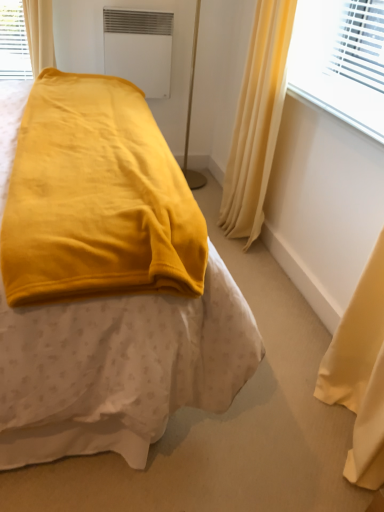
Question: Would you say white matte air conditioning unit at upper center contains smooth plastic window sill at upper right?

Choices:
 (A) no
 (B) yes

Answer: (A)

Question: Does white matte air conditioning unit at upper center come in front of smooth plastic window sill at upper right?

Choices:
 (A) no
 (B) yes

Answer: (A)

Question: Does white matte air conditioning unit at upper center appear on the left side of smooth plastic window sill at upper right?

Choices:
 (A) no
 (B) yes

Answer: (B)

Question: Are white matte air conditioning unit at upper center and smooth plastic window sill at upper right making contact?

Choices:
 (A) yes
 (B) no

Answer: (B)

Question: Considering the relative sizes of white matte air conditioning unit at upper center and smooth plastic window sill at upper right in the image provided, is white matte air conditioning unit at upper center bigger than smooth plastic window sill at upper right?

Choices:
 (A) yes
 (B) no

Answer: (A)

Question: Is white matte air conditioning unit at upper center thinner than smooth plastic window sill at upper right?

Choices:
 (A) no
 (B) yes

Answer: (B)

Question: Can silky yellow curtain at upper right be found inside velvet yellow blanket at center?

Choices:
 (A) no
 (B) yes

Answer: (A)

Question: Is velvet yellow blanket at center not near silky yellow curtain at upper right?

Choices:
 (A) yes
 (B) no

Answer: (A)

Question: Does velvet yellow blanket at center have a lesser height compared to silky yellow curtain at upper right?

Choices:
 (A) yes
 (B) no

Answer: (B)

Question: Is velvet yellow blanket at center positioned with its back to silky yellow curtain at upper right?

Choices:
 (A) yes
 (B) no

Answer: (B)

Question: Is velvet yellow blanket at center positioned before silky yellow curtain at upper right?

Choices:
 (A) yes
 (B) no

Answer: (A)

Question: Does velvet yellow blanket at center lie behind silky yellow curtain at upper right?

Choices:
 (A) yes
 (B) no

Answer: (B)

Question: Is silky yellow curtain at upper right at the right side of velvet yellow blanket at center?

Choices:
 (A) yes
 (B) no

Answer: (A)